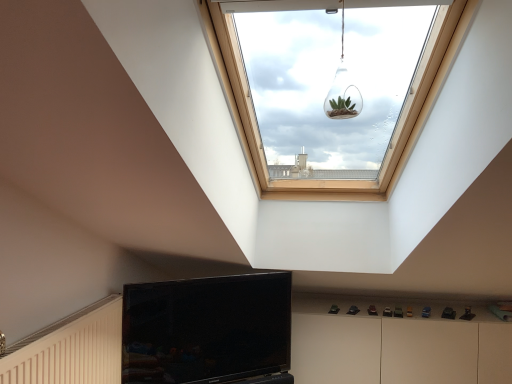
Question: Based on their positions, is white glossy dresser at lower right located to the left or right of black glossy tv at lower center?

Choices:
 (A) left
 (B) right

Answer: (B)

Question: In terms of size, does white glossy dresser at lower right appear bigger or smaller than black glossy tv at lower center?

Choices:
 (A) big
 (B) small

Answer: (A)

Question: Which object is positioned farthest from the clear glass terrarium at upper center?

Choices:
 (A) white glossy dresser at lower right
 (B) black glossy tv at lower center

Answer: (A)

Question: Estimate the real-world distances between objects in this image. Which object is closer to the clear glass terrarium at upper center?

Choices:
 (A) black glossy tv at lower center
 (B) white glossy dresser at lower right

Answer: (A)